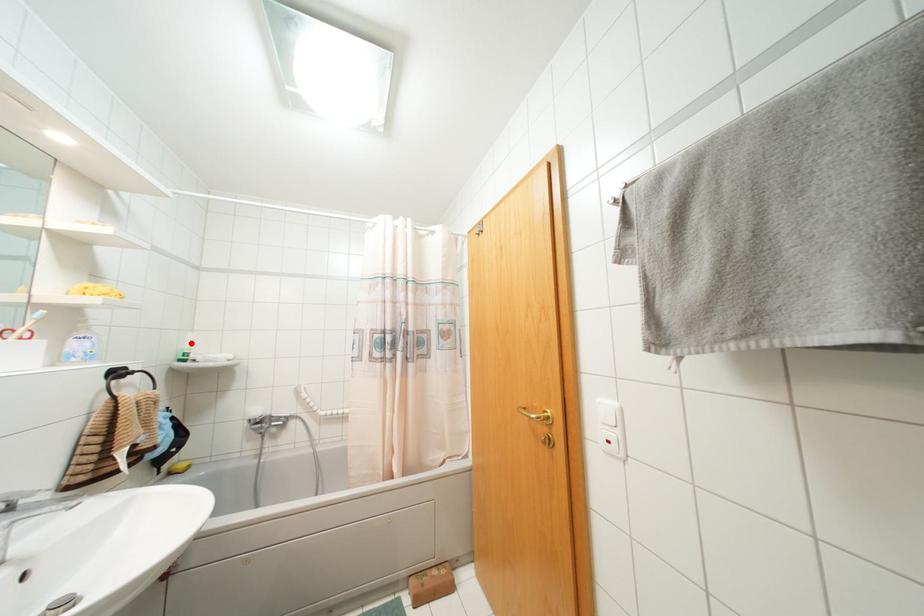
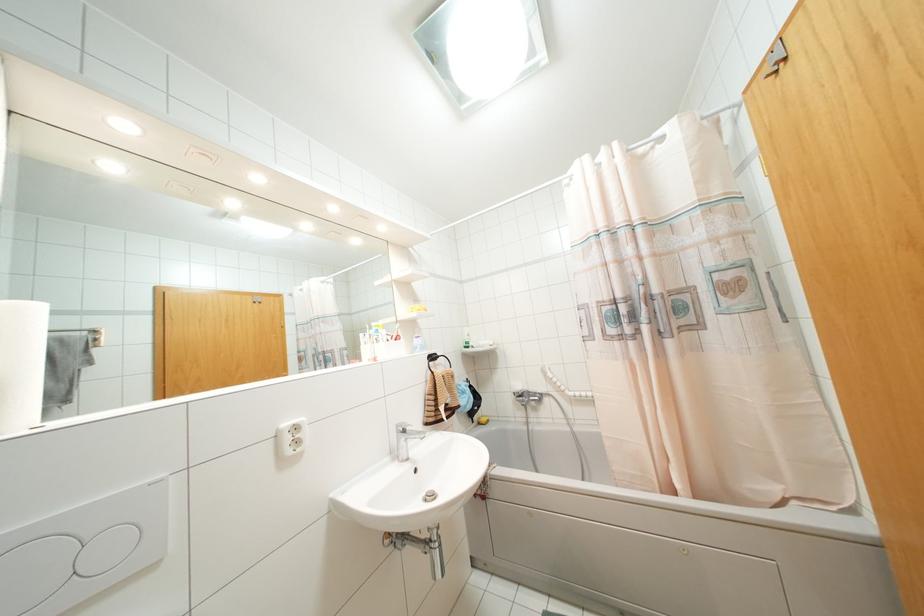
In the second image, find the point that corresponds to the highlighted location in the first image.

(468, 334)